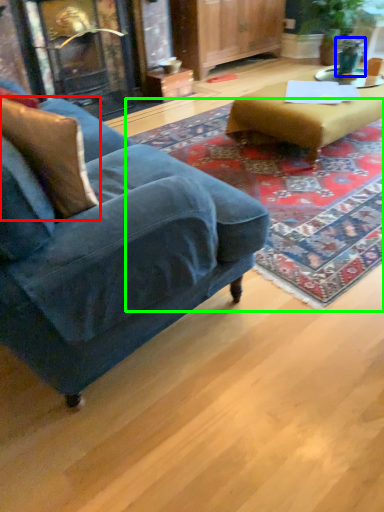
Question: Based on their relative distances, which object is nearer to pillow (highlighted by a red box)? Choose from teal (highlighted by a blue box) and mat (highlighted by a green box).

Choices:
 (A) teal
 (B) mat

Answer: (B)